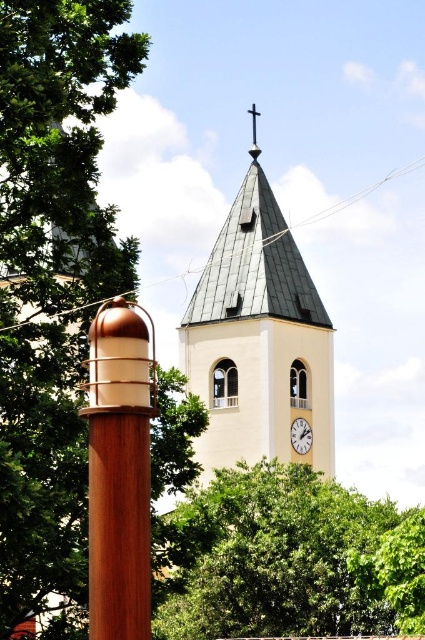
Question: Does green leafy tree at upper left have a greater width compared to white matte clock at center?

Choices:
 (A) no
 (B) yes

Answer: (B)

Question: Is green leafy tree at upper left to the right of wooden post at center from the viewer's perspective?

Choices:
 (A) yes
 (B) no

Answer: (B)

Question: Which point appears farthest from the camera in this image?

Choices:
 (A) (138, 444)
 (B) (272, 419)

Answer: (B)

Question: Among these objects, which one is farthest from the camera?

Choices:
 (A) white smooth clock tower at center
 (B) wooden post at center

Answer: (A)

Question: Among these objects, which one is nearest to the camera?

Choices:
 (A) white smooth clock tower at center
 (B) green leafy tree at upper left
 (C) white matte clock at center
 (D) green leafy tree at upper center

Answer: (B)

Question: Is white smooth clock tower at center bigger than white matte clock at center?

Choices:
 (A) yes
 (B) no

Answer: (A)